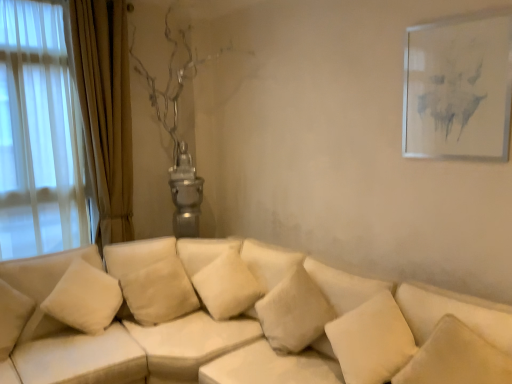
Measure the distance between white matte picture frame at upper right and camera.

The depth of white matte picture frame at upper right is 5.78 feet.

What is the approximate height of white matte picture frame at upper right?

26.33 inches.

Describe the element at coordinates (372, 340) in the screenshot. Image resolution: width=512 pixels, height=384 pixels. I see `white soft pillow at lower right, placed as the fourth pillow when sorted from left to right` at that location.

What do you see at coordinates (159, 292) in the screenshot?
I see `white soft pillow at center, arranged as the 1th pillow when viewed from the left` at bounding box center [159, 292].

You are a GUI agent. You are given a task and a screenshot of the screen. Output one action in this format:
    pyautogui.click(x=<x>, y=<y>)
    Task: Click on the soft beige cushion at center, the 3th pillow viewed from the left
    The image size is (512, 384).
    Given the screenshot: What is the action you would take?
    pyautogui.click(x=294, y=312)

From the image's perspective, is white soft pillow at lower right, the second pillow from the right, beneath soft beige cushion at center, which ranks as the third pillow in right-to-left order?

Yes.

Would you say white soft pillow at lower right, the second pillow from the right, is to the left or to the right of soft beige cushion at center, which ranks as the third pillow in right-to-left order, in the picture?

Based on their positions, white soft pillow at lower right, the second pillow from the right, is located to the right of soft beige cushion at center, which ranks as the third pillow in right-to-left order.

From the picture: Does white soft pillow at lower right, placed as the fourth pillow when sorted from left to right, touch soft beige cushion at center, which ranks as the third pillow in right-to-left order?

No, white soft pillow at lower right, placed as the fourth pillow when sorted from left to right, is not in contact with soft beige cushion at center, which ranks as the third pillow in right-to-left order.

From the image's perspective, count 2nd pillows upward from the white soft pillow at lower right, the second pillow from the right, and point to it. Please provide its 2D coordinates.

[(294, 312)]

Is soft beige cushion at center, which ranks as the third pillow in right-to-left order, beside white soft pillow at lower right, arranged as the 1th pillow when viewed from the right?

soft beige cushion at center, which ranks as the third pillow in right-to-left order, and white soft pillow at lower right, arranged as the 1th pillow when viewed from the right, are clearly separated.

Between soft beige cushion at center, the 3th pillow viewed from the left, and white soft pillow at lower right, which is the fifth pillow from left to right, which one has less height?

soft beige cushion at center, the 3th pillow viewed from the left, is shorter.

Is soft beige cushion at center, the 3th pillow viewed from the left, spatially inside white soft pillow at lower right, arranged as the 1th pillow when viewed from the right, or outside of it?

soft beige cushion at center, the 3th pillow viewed from the left, cannot be found inside white soft pillow at lower right, arranged as the 1th pillow when viewed from the right.

Is soft beige cushion at center, the 3th pillow viewed from the left, closer to the viewer compared to white soft pillow at lower right, which is the fifth pillow from left to right?

No, soft beige cushion at center, the 3th pillow viewed from the left, is behind white soft pillow at lower right, which is the fifth pillow from left to right.

Consider the image. Which of these two, white soft pillow at center, arranged as the 1th pillow when viewed from the left, or white fabric couch at center, stands shorter?

white soft pillow at center, arranged as the 1th pillow when viewed from the left.

Which is behind, point (174, 276) or point (143, 371)?

The point (174, 276) is farther from the camera.

From a real-world perspective, which object stands above the other?

white soft pillow at center, arranged as the 1th pillow when viewed from the left.

Is white soft pillow at center, acting as the 5th pillow starting from the right, next to white fabric couch at center and touching it?

No, white soft pillow at center, acting as the 5th pillow starting from the right, is not in contact with white fabric couch at center.

Is soft beige cushion at center, which ranks as the third pillow in right-to-left order, bigger than white soft pillow at center, acting as the 5th pillow starting from the right?

Indeed, soft beige cushion at center, which ranks as the third pillow in right-to-left order, has a larger size compared to white soft pillow at center, acting as the 5th pillow starting from the right.

Considering the points (270, 292) and (134, 272), which point is in front, point (270, 292) or point (134, 272)?

Positioned in front is point (270, 292).

Consider the image. From a real-world perspective, who is located higher, soft beige cushion at center, which ranks as the third pillow in right-to-left order, or white soft pillow at center, acting as the 5th pillow starting from the right?

In real-world perspective, soft beige cushion at center, which ranks as the third pillow in right-to-left order, is above.

Is white soft pillow at center, acting as the 5th pillow starting from the right, a part of soft beige cushion at center, which ranks as the third pillow in right-to-left order?

No, white soft pillow at center, acting as the 5th pillow starting from the right, is located outside of soft beige cushion at center, which ranks as the third pillow in right-to-left order.

Is white fabric couch at center looking in the opposite direction of white soft pillow at center, acting as the 5th pillow starting from the right?

No, white fabric couch at center's orientation is not away from white soft pillow at center, acting as the 5th pillow starting from the right.

Considering the sizes of white fabric couch at center and white soft pillow at center, arranged as the 1th pillow when viewed from the left, in the image, is white fabric couch at center taller or shorter than white soft pillow at center, arranged as the 1th pillow when viewed from the left,?

Considering their sizes, white fabric couch at center has more height than white soft pillow at center, arranged as the 1th pillow when viewed from the left.

Between white fabric couch at center and white soft pillow at center, acting as the 5th pillow starting from the right, which one appears on the right side from the viewer's perspective?

white fabric couch at center is more to the right.

Considering the relative sizes of white fabric couch at center and white soft pillow at center, acting as the 5th pillow starting from the right, in the image provided, is white fabric couch at center smaller than white soft pillow at center, acting as the 5th pillow starting from the right,?

No.

How different are the orientations of soft beige cushion at center, which ranks as the third pillow in right-to-left order, and white soft pillow at center, which is the second pillow from left to right, in degrees?

soft beige cushion at center, which ranks as the third pillow in right-to-left order, and white soft pillow at center, which is the second pillow from left to right, are facing 17.3 degrees away from each other.

Is point (318, 331) less distant than point (242, 271)?

Yes.

Could you tell me if soft beige cushion at center, the 3th pillow viewed from the left, is turned towards white soft pillow at center, which is the second pillow from left to right?

No.

From the image's perspective, is soft beige cushion at center, which ranks as the third pillow in right-to-left order, over white soft pillow at center, the 4th pillow from the right?

No, from the image's perspective, soft beige cushion at center, which ranks as the third pillow in right-to-left order, is not over white soft pillow at center, the 4th pillow from the right.

Consider the image. Is white soft pillow at center, arranged as the 1th pillow when viewed from the left, positioned with its back to white soft pillow at center, the 4th pillow from the right?

No, white soft pillow at center, arranged as the 1th pillow when viewed from the left, is not facing away from white soft pillow at center, the 4th pillow from the right.

From the image's perspective, is white soft pillow at center, arranged as the 1th pillow when viewed from the left, under white soft pillow at center, the 4th pillow from the right?

Yes, from the image's perspective, white soft pillow at center, arranged as the 1th pillow when viewed from the left, is below white soft pillow at center, the 4th pillow from the right.

Is white soft pillow at center, arranged as the 1th pillow when viewed from the left, to the right of white soft pillow at center, which is the second pillow from left to right, from the viewer's perspective?

Incorrect, white soft pillow at center, arranged as the 1th pillow when viewed from the left, is not on the right side of white soft pillow at center, which is the second pillow from left to right.

You are a GUI agent. You are given a task and a screenshot of the screen. Output one action in this format:
    pyautogui.click(x=<x>, y=<y>)
    Task: Click on the pillow that is the 1st object directly below the white soft pillow at lower right, placed as the fourth pillow when sorted from left to right (from a real-world perspective)
    The height and width of the screenshot is (384, 512).
    Given the screenshot: What is the action you would take?
    pyautogui.click(x=294, y=312)

Starting from the white soft pillow at lower right, which is the fifth pillow from left to right, which pillow is the 2nd one to the left? Please provide its 2D coordinates.

[(294, 312)]

Which object lies nearer to the anchor point white soft pillow at lower right, which is the fifth pillow from left to right, white soft pillow at center, arranged as the 1th pillow when viewed from the left, or white soft pillow at center, which is the second pillow from left to right?

Among the two, white soft pillow at center, which is the second pillow from left to right, is located nearer to white soft pillow at lower right, which is the fifth pillow from left to right.

Which object lies further to the anchor point soft beige cushion at center, which ranks as the third pillow in right-to-left order, white soft pillow at center, which is the second pillow from left to right, or white soft pillow at lower right, placed as the fourth pillow when sorted from left to right?

white soft pillow at center, which is the second pillow from left to right.

Which object lies nearer to the anchor point white soft pillow at center, which is the second pillow from left to right, soft beige cushion at center, which ranks as the third pillow in right-to-left order, or white matte picture frame at upper right?

soft beige cushion at center, which ranks as the third pillow in right-to-left order, is positioned closer to the anchor white soft pillow at center, which is the second pillow from left to right.

Considering their positions, is soft beige cushion at center, which ranks as the third pillow in right-to-left order, positioned further to white soft pillow at lower right, placed as the fourth pillow when sorted from left to right, than white soft pillow at center, arranged as the 1th pillow when viewed from the left?

Based on the image, white soft pillow at center, arranged as the 1th pillow when viewed from the left, appears to be further to white soft pillow at lower right, placed as the fourth pillow when sorted from left to right.

From the image, which object appears to be nearer to white fabric couch at center, white soft pillow at center, the 4th pillow from the right, or white soft pillow at lower right, the second pillow from the right?

The object closer to white fabric couch at center is white soft pillow at center, the 4th pillow from the right.

Based on their spatial positions, is white soft pillow at center, arranged as the 1th pillow when viewed from the left, or white soft pillow at lower right, placed as the fourth pillow when sorted from left to right, closer to white fabric couch at center?

white soft pillow at center, arranged as the 1th pillow when viewed from the left, is closer to white fabric couch at center.

Estimate the real-world distances between objects in this image. Which object is further from soft beige cushion at center, the 3th pillow viewed from the left, white soft pillow at lower right, the second pillow from the right, or white matte picture frame at upper right?

white matte picture frame at upper right is further to soft beige cushion at center, the 3th pillow viewed from the left.

Which object lies further to the anchor point white fabric couch at center, white soft pillow at center, arranged as the 1th pillow when viewed from the left, or white matte picture frame at upper right?

Based on the image, white matte picture frame at upper right appears to be further to white fabric couch at center.

Locate an element on the screen. This screenshot has width=512, height=384. pillow between white soft pillow at center, which is the second pillow from left to right, and white soft pillow at lower right, the second pillow from the right is located at coordinates (294, 312).

Where is `studio couch situated between white soft pillow at center, arranged as the 1th pillow when viewed from the left, and white soft pillow at lower right, which is the fifth pillow from left to right, from left to right`? The image size is (512, 384). studio couch situated between white soft pillow at center, arranged as the 1th pillow when viewed from the left, and white soft pillow at lower right, which is the fifth pillow from left to right, from left to right is located at coordinates (236, 320).

Image resolution: width=512 pixels, height=384 pixels. What are the coordinates of `pillow between white fabric couch at center and white soft pillow at lower right, placed as the fourth pillow when sorted from left to right, from front to back` in the screenshot? It's located at (456, 358).

Where is `pillow between white soft pillow at center, acting as the 5th pillow starting from the right, and soft beige cushion at center, the 3th pillow viewed from the left, from left to right`? This screenshot has width=512, height=384. pillow between white soft pillow at center, acting as the 5th pillow starting from the right, and soft beige cushion at center, the 3th pillow viewed from the left, from left to right is located at coordinates (227, 286).